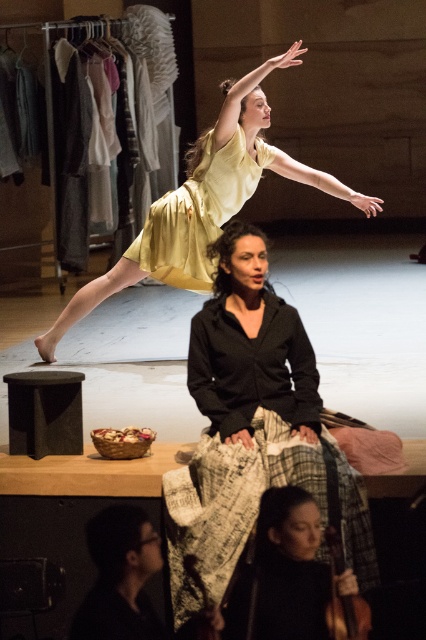
You are an event planner setting up a stage for a performance. The stage has a spotlight at position coordinates 0.334, 0.465. You need to place a prop that must be exactly where the yellow satin dress at upper center is located. Where should you position the prop?

The yellow satin dress at upper center is located at coordinates (198, 212), so the prop should be placed at that exact position.